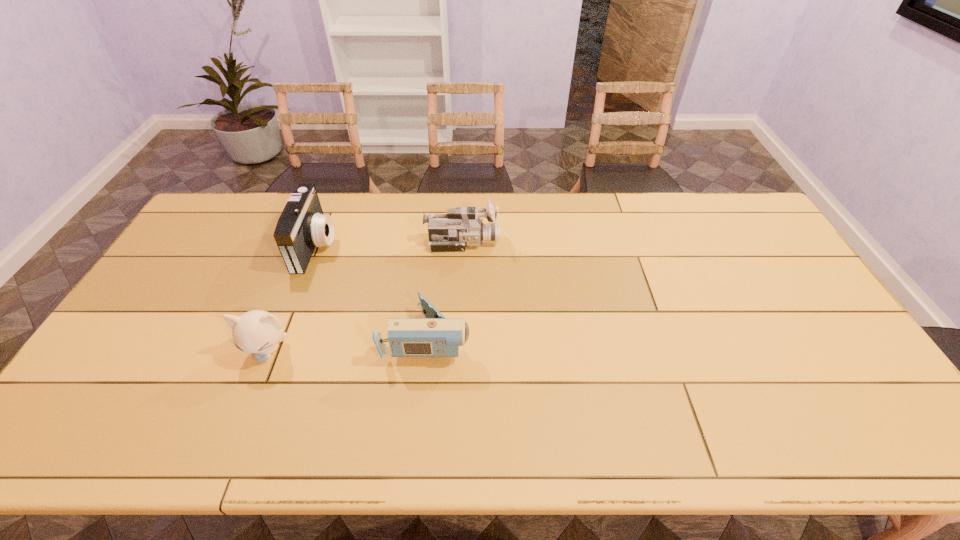
Where is `camcorder object that ranks as the second closest to the leftmost camcorder`? The image size is (960, 540). camcorder object that ranks as the second closest to the leftmost camcorder is located at coordinates (461, 227).

I want to click on blank area in the image that satisfies the following two spatial constraints: 1. on the side of the shortest camcorder with the flip-out screen; 2. on the face of the kitten, so click(x=426, y=350).

At what (x,y) coordinates should I click in order to perform the action: click on vacant point that satisfies the following two spatial constraints: 1. on the lens of the leftmost camcorder; 2. on the face of the kitten. Please return your answer as a coordinate pair (x, y). Looking at the image, I should click on (276, 350).

This screenshot has width=960, height=540. What are the coordinates of `vacant space that satisfies the following two spatial constraints: 1. on the lens of the leftmost camcorder; 2. on the face of the kitten` in the screenshot? It's located at (276, 350).

You are a GUI agent. You are given a task and a screenshot of the screen. Output one action in this format:
    pyautogui.click(x=<x>, y=<y>)
    Task: Click on the vacant space that satisfies the following two spatial constraints: 1. on the side of the nearest camcorder with the flip-out screen; 2. on the face of the kitten
    This screenshot has width=960, height=540.
    Given the screenshot: What is the action you would take?
    pyautogui.click(x=426, y=350)

Locate an element on the screen. free space that satisfies the following two spatial constraints: 1. on the lens of the leftmost camcorder; 2. on the face of the kitten is located at coordinates (276, 350).

At what (x,y) coordinates should I click in order to perform the action: click on vacant area in the image that satisfies the following two spatial constraints: 1. on the side of the shortest camcorder with the flip-out screen; 2. on the face of the kitten. Please return your answer as a coordinate pair (x, y). This screenshot has width=960, height=540. Looking at the image, I should click on (426, 350).

Where is `vacant space that satisfies the following two spatial constraints: 1. on the side of the shortest camcorder with the flip-out screen; 2. on the face of the kitten`? Image resolution: width=960 pixels, height=540 pixels. vacant space that satisfies the following two spatial constraints: 1. on the side of the shortest camcorder with the flip-out screen; 2. on the face of the kitten is located at coordinates (426, 350).